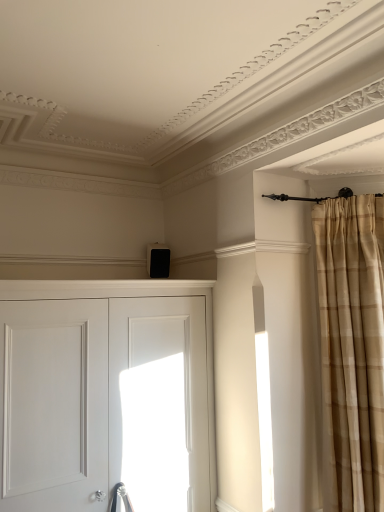
In order to click on beige plaid curtain at right in this screenshot , I will do `click(352, 348)`.

What do you see at coordinates (352, 348) in the screenshot? The height and width of the screenshot is (512, 384). I see `beige plaid curtain at right` at bounding box center [352, 348].

This screenshot has height=512, width=384. Describe the element at coordinates (132, 296) in the screenshot. I see `white matte door at center` at that location.

Locate an element on the screen. white matte door at center is located at coordinates (132, 296).

Find the location of `beige plaid curtain at right`. beige plaid curtain at right is located at coordinates (352, 348).

Can you confirm if white matte door at center is positioned to the right of beige plaid curtain at right?

No.

Considering the positions of objects white matte door at center and beige plaid curtain at right in the image provided, who is in front, white matte door at center or beige plaid curtain at right?

Positioned in front is white matte door at center.

Does point (192, 287) come in front of point (358, 295)?

No.

From the image's perspective, is white matte door at center located above or below beige plaid curtain at right?

white matte door at center is situated lower than beige plaid curtain at right in the image.

From a real-world perspective, is white matte door at center physically above beige plaid curtain at right?

Incorrect, from a real-world perspective, white matte door at center is lower than beige plaid curtain at right.

Is white matte door at center wider than beige plaid curtain at right?

Correct, the width of white matte door at center exceeds that of beige plaid curtain at right.

Is white matte door at center taller than beige plaid curtain at right?

No, white matte door at center is not taller than beige plaid curtain at right.

Who is smaller, white matte door at center or beige plaid curtain at right?

beige plaid curtain at right is smaller.

Would you say white matte door at center contains beige plaid curtain at right?

No, beige plaid curtain at right is not inside white matte door at center.

Is there a large distance between white matte door at center and beige plaid curtain at right?

No, white matte door at center is not far from beige plaid curtain at right.

Is beige plaid curtain at right at the back of white matte door at center?

That's not correct — white matte door at center is not looking away from beige plaid curtain at right.

How many degrees apart are the facing directions of white matte door at center and beige plaid curtain at right?

white matte door at center and beige plaid curtain at right are facing 36.5 degrees away from each other.

Find the location of a particular element. curtain located behind the white matte door at center is located at coordinates (352, 348).

Which is more to the right, beige plaid curtain at right or white matte door at center?

Positioned to the right is beige plaid curtain at right.

Is beige plaid curtain at right positioned in front of white matte door at center?

That is False.

Between point (340, 340) and point (215, 470), which one is positioned in front?

The point (340, 340) is in front.

From the image's perspective, is beige plaid curtain at right above or below white matte door at center?

beige plaid curtain at right is situated higher than white matte door at center in the image.

From a real-world perspective, is beige plaid curtain at right above or below white matte door at center?

Clearly, from a real-world perspective, beige plaid curtain at right is above white matte door at center.

Can you confirm if beige plaid curtain at right is thinner than white matte door at center?

Yes.

In terms of height, does beige plaid curtain at right look taller or shorter compared to white matte door at center?

beige plaid curtain at right is taller than white matte door at center.

Which of these two, beige plaid curtain at right or white matte door at center, is bigger?

With larger size is white matte door at center.

Is beige plaid curtain at right not within white matte door at center?

beige plaid curtain at right is positioned outside white matte door at center.

Are beige plaid curtain at right and white matte door at center beside each other?

beige plaid curtain at right and white matte door at center are not in contact.

Is beige plaid curtain at right oriented towards white matte door at center?

No, beige plaid curtain at right does not turn towards white matte door at center.

How many degrees apart are the facing directions of beige plaid curtain at right and white matte door at center?

They differ by 36.5 degrees in their facing directions.

Identify the location of door below the beige plaid curtain at right (from the image's perspective). Image resolution: width=384 pixels, height=512 pixels. (132, 296).

The image size is (384, 512). Find the location of `door on the left of beige plaid curtain at right`. door on the left of beige plaid curtain at right is located at coordinates (132, 296).

I want to click on door beneath the beige plaid curtain at right (from a real-world perspective), so click(132, 296).